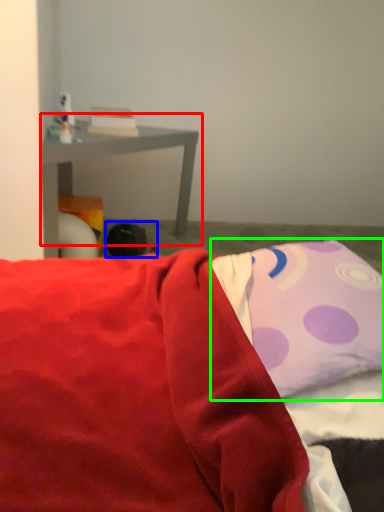
Question: Estimate the real-world distances between objects in this image. Which object is closer to table (highlighted by a red box), bean bag chair (highlighted by a blue box) or pillow (highlighted by a green box)?

Choices:
 (A) bean bag chair
 (B) pillow

Answer: (A)